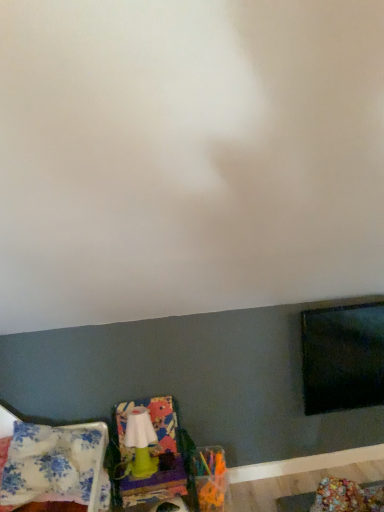
Question: From a real-world perspective, is green plastic swivel chair at lower left positioned above or below floral fabric pillow at lower left?

Choices:
 (A) above
 (B) below

Answer: (B)

Question: Is point (190, 483) closer or farther from the camera than point (34, 497)?

Choices:
 (A) farther
 (B) closer

Answer: (A)

Question: Estimate the real-world distances between objects in this image. Which object is closer to the green plastic swivel chair at lower left?

Choices:
 (A) floral fabric pillow at lower left
 (B) green matte lamp at lower left

Answer: (B)

Question: Based on their relative distances, which object is farther from the green matte lamp at lower left?

Choices:
 (A) floral fabric pillow at lower left
 (B) green plastic swivel chair at lower left

Answer: (A)